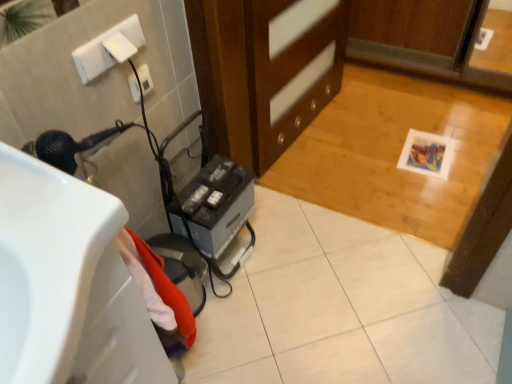
Locate an element on the screen. free space above metallic gray hair dryer at lower left (from a real-world perspective) is located at coordinates click(x=211, y=187).